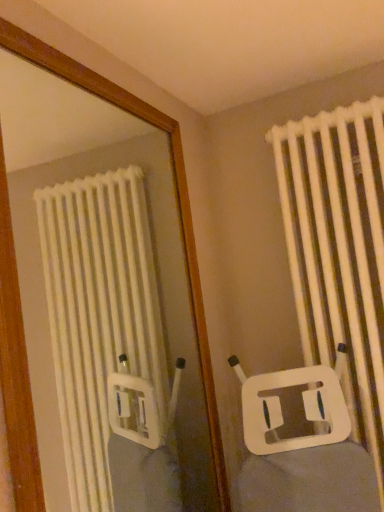
Describe the element at coordinates (152, 245) in the screenshot. I see `white plastic mirror at upper center` at that location.

The height and width of the screenshot is (512, 384). I want to click on white plastic mirror at upper center, so click(152, 245).

This screenshot has height=512, width=384. I want to click on white plastic radiator at right, so point(339,250).

This screenshot has width=384, height=512. Describe the element at coordinates (339, 250) in the screenshot. I see `white plastic radiator at right` at that location.

Where is `white plastic mirror at upper center`? The width and height of the screenshot is (384, 512). white plastic mirror at upper center is located at coordinates (152, 245).

Which is more to the left, white plastic mirror at upper center or white plastic radiator at right?

From the viewer's perspective, white plastic mirror at upper center appears more on the left side.

Which object is further away from the camera, white plastic mirror at upper center or white plastic radiator at right?

white plastic radiator at right is further away from the camera.

Does point (33, 163) lie in front of point (368, 259)?

That is False.

From the image's perspective, who appears lower, white plastic mirror at upper center or white plastic radiator at right?

From the image's view, white plastic mirror at upper center is below.

From a real-world perspective, who is located higher, white plastic mirror at upper center or white plastic radiator at right?

white plastic mirror at upper center.

Can you confirm if white plastic mirror at upper center is thinner than white plastic radiator at right?

Yes, white plastic mirror at upper center is thinner than white plastic radiator at right.

In the scene shown: Is white plastic mirror at upper center shorter than white plastic radiator at right?

Yes.

Based on their sizes in the image, would you say white plastic mirror at upper center is bigger or smaller than white plastic radiator at right?

Considering their sizes, white plastic mirror at upper center takes up less space than white plastic radiator at right.

Is white plastic radiator at right a part of white plastic mirror at upper center?

Actually, white plastic radiator at right is outside white plastic mirror at upper center.

Is white plastic mirror at upper center far from white plastic radiator at right?

No, white plastic mirror at upper center is in close proximity to white plastic radiator at right.

Is white plastic mirror at upper center facing away from white plastic radiator at right?

No, white plastic mirror at upper center is not facing away from white plastic radiator at right.

Can you tell me how much white plastic mirror at upper center and white plastic radiator at right differ in facing direction?

91.4 degrees separate the facing orientations of white plastic mirror at upper center and white plastic radiator at right.

How far apart are white plastic mirror at upper center and white plastic radiator at right?

white plastic mirror at upper center is 24.86 inches away from white plastic radiator at right.

Image resolution: width=384 pixels, height=512 pixels. Find the location of `mirror that appears in front of the white plastic radiator at right`. mirror that appears in front of the white plastic radiator at right is located at coordinates [x=152, y=245].

Can you confirm if white plastic radiator at right is positioned to the right of white plastic mirror at upper center?

Yes, white plastic radiator at right is to the right of white plastic mirror at upper center.

Is white plastic radiator at right in front of or behind white plastic mirror at upper center in the image?

In the image, white plastic radiator at right appears behind white plastic mirror at upper center.

Is point (310, 276) positioned in front of point (51, 472)?

Yes, it is.

From the image's perspective, is white plastic radiator at right below white plastic mirror at upper center?

Incorrect, from the image's perspective, white plastic radiator at right is higher than white plastic mirror at upper center.

From a real-world perspective, relative to white plastic mirror at upper center, is white plastic radiator at right vertically above or below?

white plastic radiator at right is situated lower than white plastic mirror at upper center in the real world.

Can you confirm if white plastic radiator at right is wider than white plastic mirror at upper center?

Yes, white plastic radiator at right is wider than white plastic mirror at upper center.

Between white plastic radiator at right and white plastic mirror at upper center, which one has more height?

With more height is white plastic radiator at right.

Can you confirm if white plastic radiator at right is smaller than white plastic mirror at upper center?

Actually, white plastic radiator at right might be larger than white plastic mirror at upper center.

Would you say white plastic radiator at right is inside or outside white plastic mirror at upper center?

white plastic radiator at right is located beyond the bounds of white plastic mirror at upper center.

Is white plastic radiator at right not close to white plastic mirror at upper center?

No, white plastic radiator at right is not far away from white plastic mirror at upper center.

Is white plastic radiator at right oriented towards white plastic mirror at upper center?

No, white plastic radiator at right is not oriented towards white plastic mirror at upper center.

Where is `mirror below the white plastic radiator at right (from the image's perspective)`? mirror below the white plastic radiator at right (from the image's perspective) is located at coordinates (152, 245).

I want to click on curtain lying above the white plastic mirror at upper center (from the image's perspective), so click(339, 250).

Where is `curtain that appears on the right of white plastic mirror at upper center`? curtain that appears on the right of white plastic mirror at upper center is located at coordinates (339, 250).